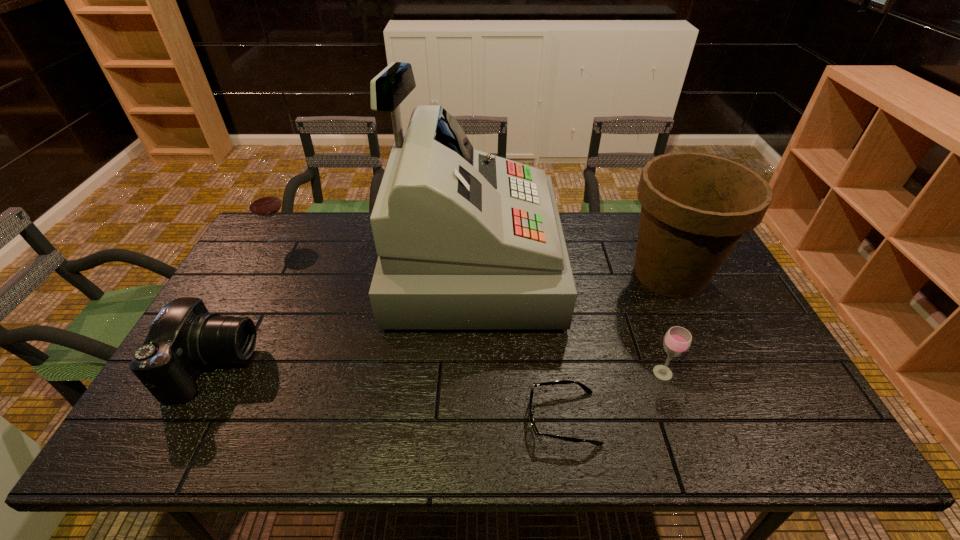
This screenshot has height=540, width=960. In order to click on vacant area that lies between the second tallest object and the spectacles in this screenshot , I will do `click(616, 346)`.

The width and height of the screenshot is (960, 540). I want to click on free space that is in between the camera and the tallest object, so click(343, 315).

The width and height of the screenshot is (960, 540). In order to click on free space between the camera and the spectacles in this screenshot , I will do `click(389, 392)`.

You are a GUI agent. You are given a task and a screenshot of the screen. Output one action in this format:
    pyautogui.click(x=<x>, y=<y>)
    Task: Click on the vacant area that lies between the camera and the cash register
    This screenshot has width=960, height=540.
    Given the screenshot: What is the action you would take?
    pyautogui.click(x=343, y=315)

What are the coordinates of `free space between the camera and the shortest object` in the screenshot? It's located at (389, 392).

Locate an element on the screen. free spot between the tallest object and the farther wineglass is located at coordinates (374, 252).

Find the location of `object that is the fourth closest one to the shortest object`. object that is the fourth closest one to the shortest object is located at coordinates (184, 337).

At what (x,y) coordinates should I click in order to perform the action: click on object that ranks as the closest to the cash register. Please return your answer as a coordinate pair (x, y). The height and width of the screenshot is (540, 960). Looking at the image, I should click on (585, 388).

At what (x,y) coordinates should I click in order to perform the action: click on vacant space that satisfies the following two spatial constraints: 1. on the keypad side of the cash register; 2. on the back side of the second tallest object. Please return your answer as a coordinate pair (x, y). Looking at the image, I should click on (470, 274).

Find the location of a particular element. Image resolution: width=960 pixels, height=540 pixels. vacant position in the image that satisfies the following two spatial constraints: 1. on the lens of the shorter wineglass; 2. on the left side of the camera is located at coordinates (211, 373).